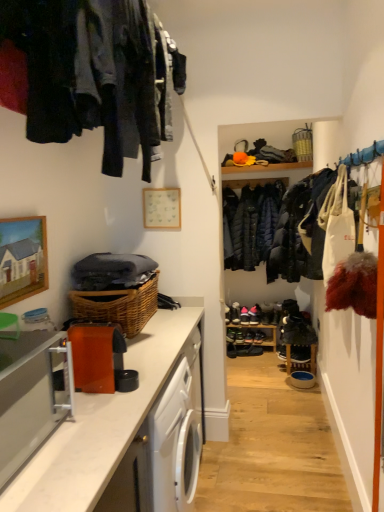
Question: Is shiny black shoe at center, acting as the 5th shoe starting from the bottom, at the right side of shiny black shoe at center, the first shoe positioned from the bottom?

Choices:
 (A) yes
 (B) no

Answer: (A)

Question: Can you confirm if shiny black shoe at center, the 2th shoe in the top-to-bottom sequence, is positioned to the left of shiny black shoe at center, the first shoe positioned from the bottom?

Choices:
 (A) yes
 (B) no

Answer: (B)

Question: Considering the relative sizes of shiny black shoe at center, acting as the 5th shoe starting from the bottom, and shiny black shoe at center, the sixth shoe from the top, in the image provided, is shiny black shoe at center, acting as the 5th shoe starting from the bottom, taller than shiny black shoe at center, the sixth shoe from the top,?

Choices:
 (A) no
 (B) yes

Answer: (B)

Question: Is shiny black shoe at center, the sixth shoe from the top, located within shiny black shoe at center, acting as the 5th shoe starting from the bottom?

Choices:
 (A) yes
 (B) no

Answer: (B)

Question: Is shiny black shoe at center, the 2th shoe in the top-to-bottom sequence, next to shiny black shoe at center, the first shoe positioned from the bottom?

Choices:
 (A) no
 (B) yes

Answer: (A)

Question: Considering the relative positions of shiny black shoe at center, the 2th shoe in the top-to-bottom sequence, and shiny black shoe at center, the sixth shoe from the top, in the image provided, is shiny black shoe at center, the 2th shoe in the top-to-bottom sequence, behind shiny black shoe at center, the sixth shoe from the top,?

Choices:
 (A) no
 (B) yes

Answer: (A)

Question: Is black leather shoe at center, arranged as the first shoe when viewed from the top, positioned far away from shiny black shoe at center, marked as the fourth shoe in a bottom-to-top arrangement?

Choices:
 (A) yes
 (B) no

Answer: (B)

Question: From a real-world perspective, is black leather shoe at center, arranged as the first shoe when viewed from the top, under shiny black shoe at center, marked as the fourth shoe in a bottom-to-top arrangement?

Choices:
 (A) yes
 (B) no

Answer: (B)

Question: From the image's perspective, does black leather shoe at center, arranged as the sixth shoe when ordered from the bottom, appear higher than shiny black shoe at center, marked as the 3th shoe in a top-to-bottom arrangement?

Choices:
 (A) no
 (B) yes

Answer: (B)

Question: Is black leather shoe at center, arranged as the sixth shoe when ordered from the bottom, bigger than shiny black shoe at center, marked as the 3th shoe in a top-to-bottom arrangement?

Choices:
 (A) yes
 (B) no

Answer: (A)

Question: Can shiny black shoe at center, marked as the 3th shoe in a top-to-bottom arrangement, be found inside black leather shoe at center, arranged as the first shoe when viewed from the top?

Choices:
 (A) yes
 (B) no

Answer: (B)

Question: From a real-world perspective, is black leather shoe at center, arranged as the first shoe when viewed from the top, located higher than shiny black shoe at center, marked as the fourth shoe in a bottom-to-top arrangement?

Choices:
 (A) yes
 (B) no

Answer: (A)

Question: Does shiny black shoe at center, marked as the fourth shoe in a bottom-to-top arrangement, have a larger size compared to woven brown basket at lower left, placed as the 1th basket when sorted from left to right?

Choices:
 (A) no
 (B) yes

Answer: (A)